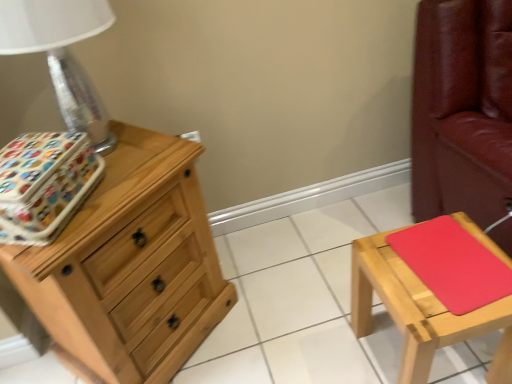
Image resolution: width=512 pixels, height=384 pixels. Identify the location of free space above natural wood chest of drawers at left (from a real-world perspective). (119, 170).